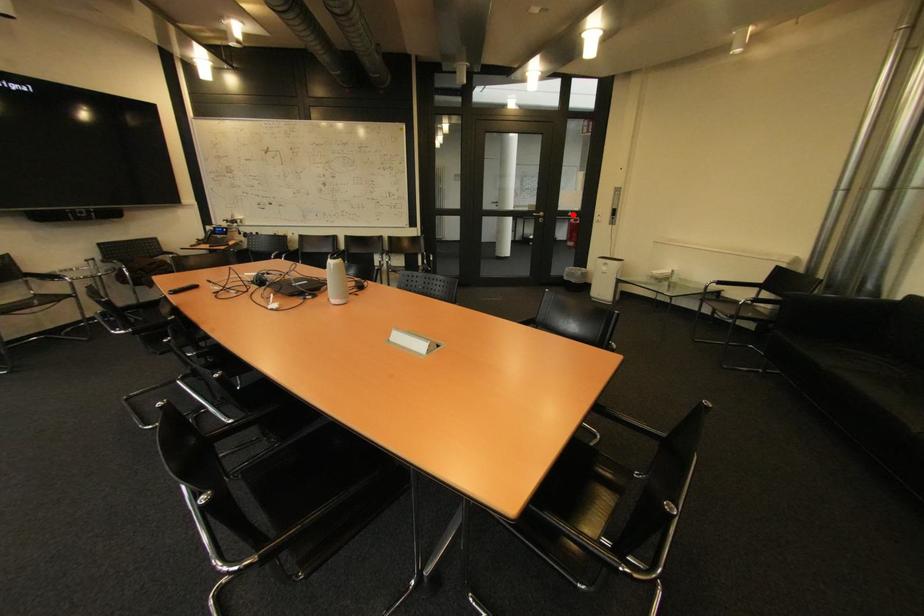
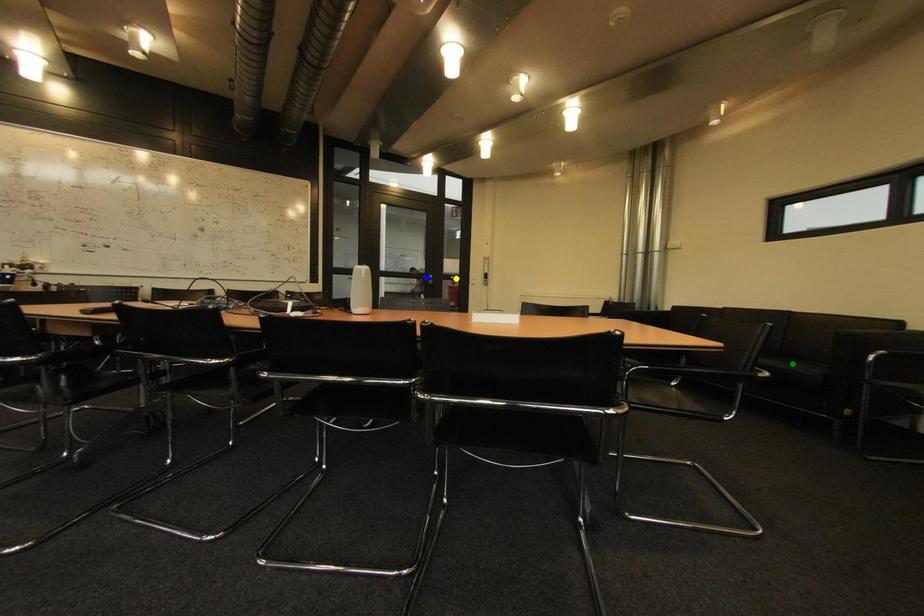
Question: I am providing you with two images of the same scene from different viewpoints. A red point is marked on the first image. You are given multiple points on the second image. Which spot in image 2 lines up with the point in image 1?

Choices:
 (A) blue point
 (B) green point
 (C) yellow point

Answer: (C)